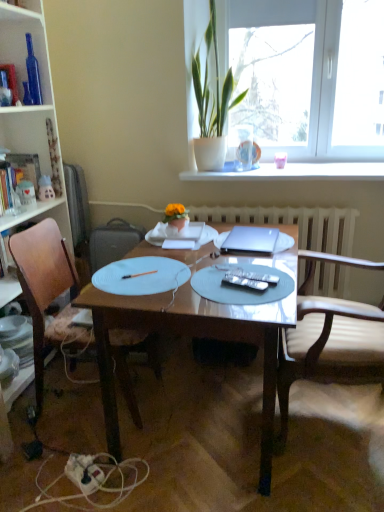
Where is `free space below wooden desk at center (from a real-world perspective)`? This screenshot has height=512, width=384. free space below wooden desk at center (from a real-world perspective) is located at coordinates (204, 415).